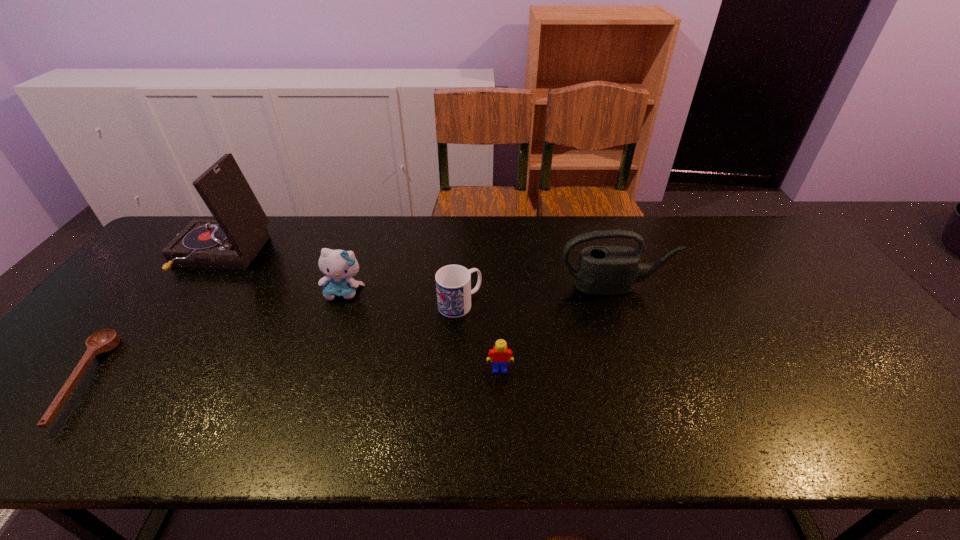
Identify the location of vacant space situated on the face of the kitten. This screenshot has width=960, height=540. (320, 364).

Where is `vacant space positioned on the front of the fourth object from left to right`? The image size is (960, 540). vacant space positioned on the front of the fourth object from left to right is located at coordinates (454, 414).

Find the location of a particular element. Image resolution: width=960 pixels, height=540 pixels. free location located on the front-facing side of the Lego is located at coordinates (502, 423).

This screenshot has height=540, width=960. Identify the location of free location located 0.220m on the right of the wooden spoon. (191, 380).

Where is `object located at the far edge`? object located at the far edge is located at coordinates (231, 241).

Identify the location of object that is at the near edge. (105, 340).

Where is `phonograph record that is at the left edge`? The height and width of the screenshot is (540, 960). phonograph record that is at the left edge is located at coordinates (231, 241).

Find the location of a particular element. The height and width of the screenshot is (540, 960). wooden spoon located in the left edge section of the desktop is located at coordinates (105, 340).

The height and width of the screenshot is (540, 960). Find the location of `object that is at the far left corner`. object that is at the far left corner is located at coordinates (231, 241).

This screenshot has height=540, width=960. Find the location of `object at the near left corner`. object at the near left corner is located at coordinates (105, 340).